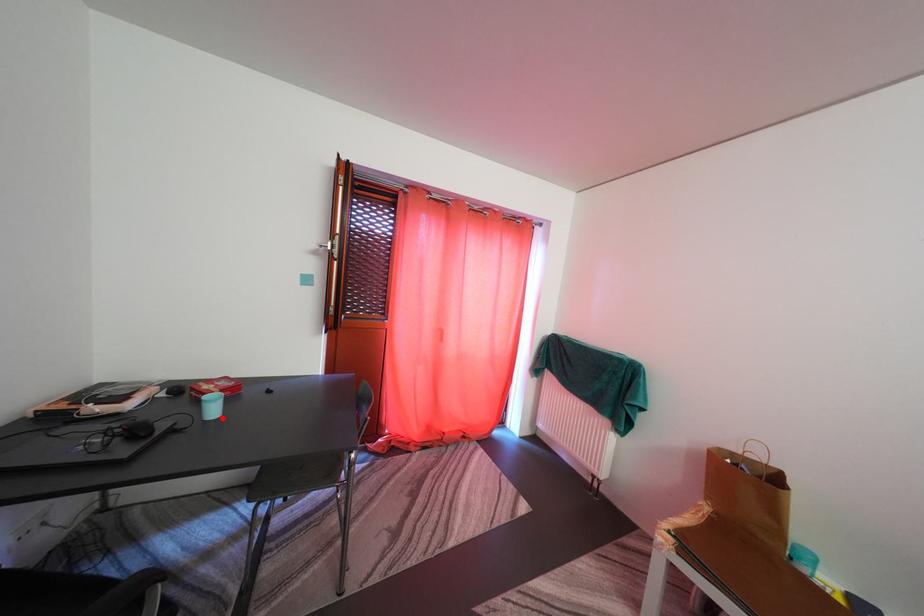
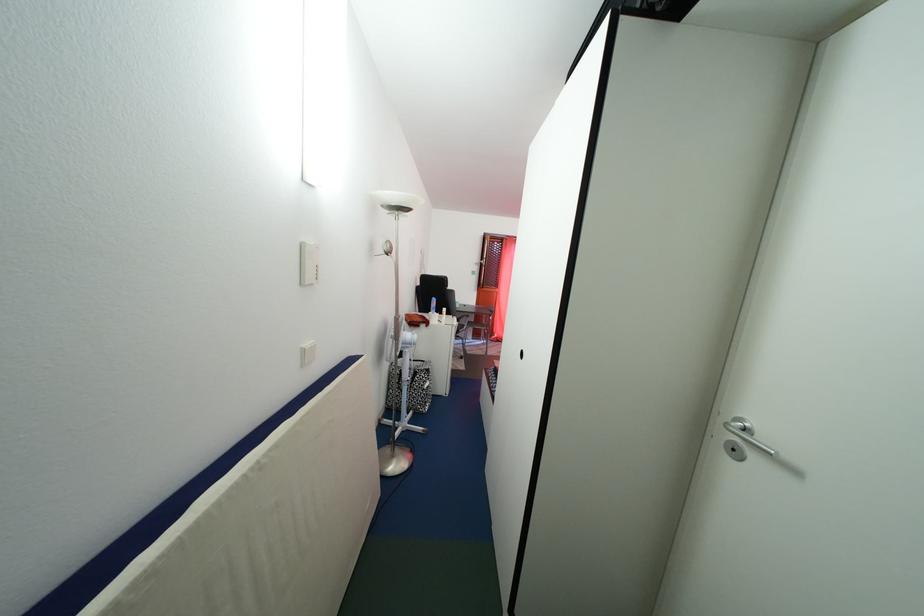
Locate, in the second image, the point that corresponds to the highlighted location in the first image.

(466, 313)